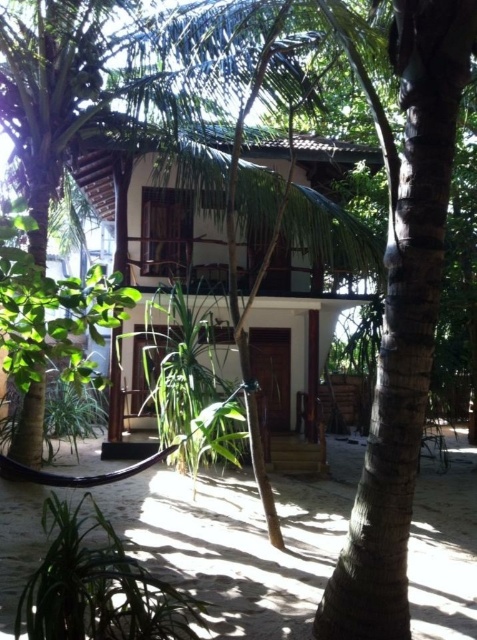
What do you see at coordinates (164, 195) in the screenshot?
I see `white wood house at center` at bounding box center [164, 195].

Is white wood house at center smaller than green leafy plant at lower left?

No, white wood house at center is not smaller than green leafy plant at lower left.

Describe the element at coordinates (164, 195) in the screenshot. I see `white wood house at center` at that location.

The width and height of the screenshot is (477, 640). Identify the location of white wood house at center. (164, 195).